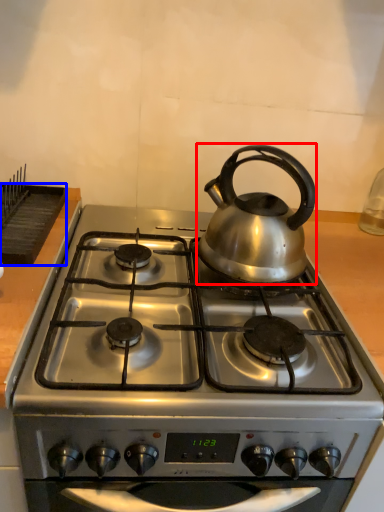
Question: Among these objects, which one is farthest to the camera, kettle (highlighted by a red box) or kitchen appliance (highlighted by a blue box)?

Choices:
 (A) kettle
 (B) kitchen appliance

Answer: (B)